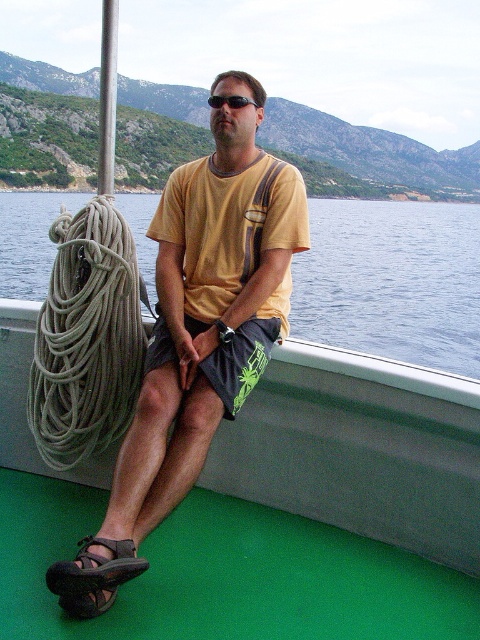
Locate an element on the screen. The width and height of the screenshot is (480, 640). blue water at center is located at coordinates (392, 282).

Based on the photo, can you confirm if blue water at center is taller than gray fabric rope at left?

Yes.

Does point (433, 346) come in front of point (73, 433)?

No, it is not.

The width and height of the screenshot is (480, 640). In order to click on blue water at center in this screenshot , I will do `click(392, 282)`.

In the scene shown: Who is higher up, blue water at center or brown leather sandal at lower left?

Positioned higher is blue water at center.

Is blue water at center to the right of brown leather sandal at lower left from the viewer's perspective?

No, blue water at center is not to the right of brown leather sandal at lower left.

Describe the element at coordinates (392, 282) in the screenshot. This screenshot has width=480, height=640. I see `blue water at center` at that location.

You are a GUI agent. You are given a task and a screenshot of the screen. Output one action in this format:
    pyautogui.click(x=<x>, y=<y>)
    Task: Click on the blue water at center
    The height and width of the screenshot is (640, 480).
    Given the screenshot: What is the action you would take?
    pyautogui.click(x=392, y=282)

Is yellow t-shirt at center shorter than gray fabric rope at left?

In fact, yellow t-shirt at center may be taller than gray fabric rope at left.

Is yellow t-shirt at center positioned in front of gray fabric rope at left?

That is True.

Is point (134, 570) closer to viewer compared to point (133, 384)?

Yes, point (134, 570) is closer to viewer.

Identify the location of yellow t-shirt at center. The width and height of the screenshot is (480, 640). (196, 333).